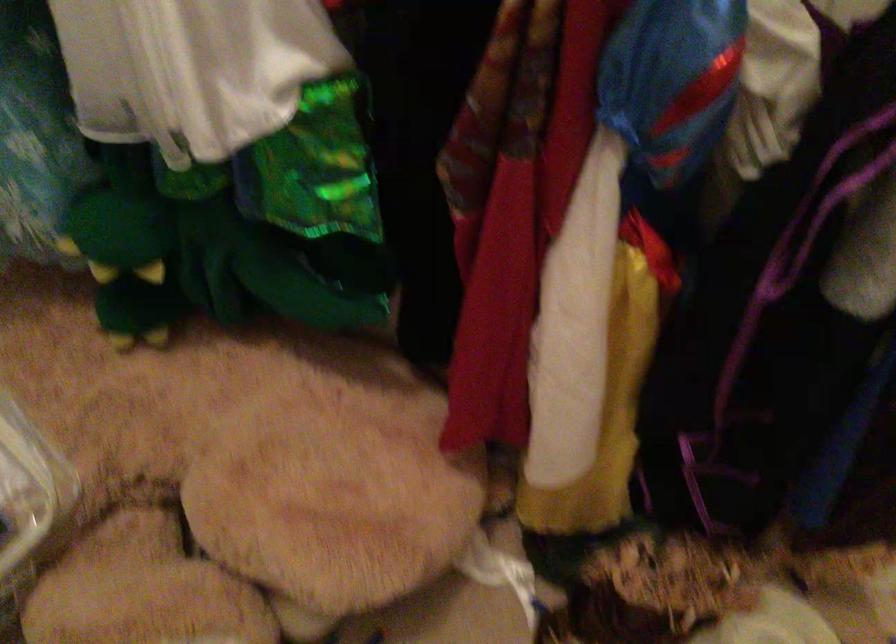
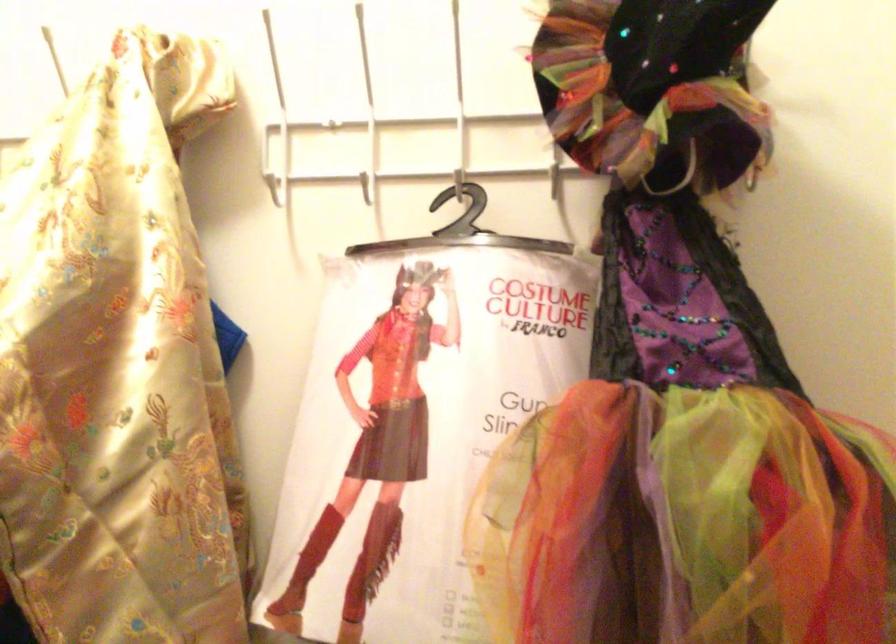
The images are taken continuously from a first-person perspective. In which direction is your viewpoint rotating?

The camera's rotation is toward right-up.